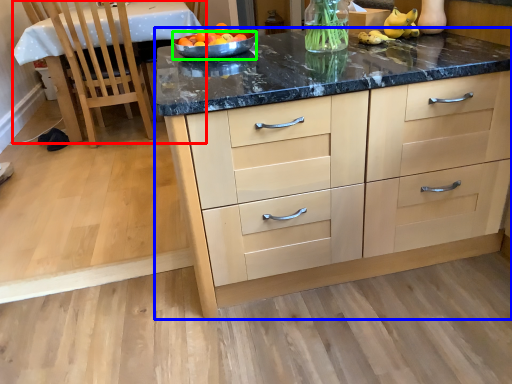
Question: Based on their relative distances, which object is nearer to table (highlighted by a red box)? Choose from cabinetry (highlighted by a blue box) and bowl (highlighted by a green box).

Choices:
 (A) cabinetry
 (B) bowl

Answer: (B)